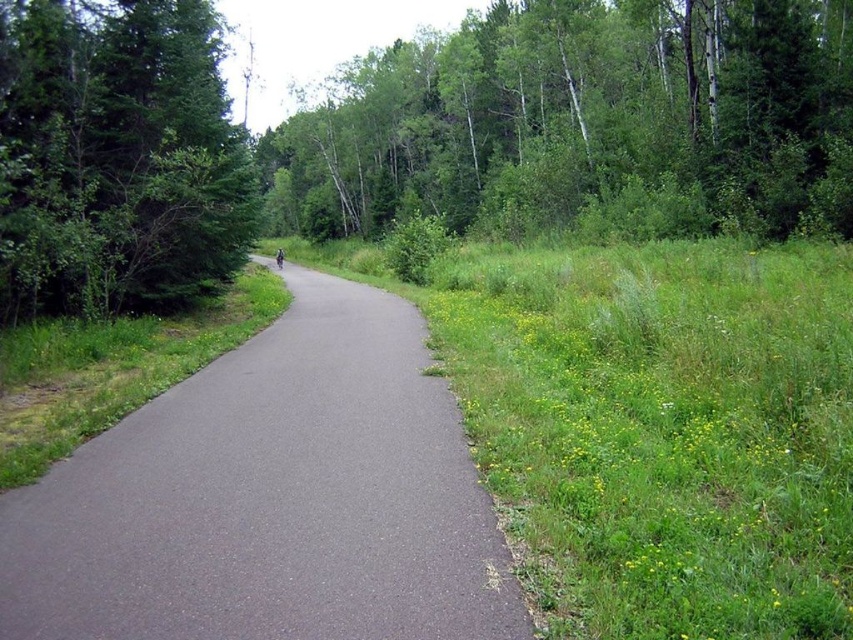
Question: Is gray asphalt trail at center positioned before green leafy tree at left?

Choices:
 (A) yes
 (B) no

Answer: (A)

Question: Which point is closer to the camera taking this photo?

Choices:
 (A) (166, 136)
 (B) (637, 195)
 (C) (378, 468)

Answer: (C)

Question: Considering the relative positions of green leafy trees at upper center and green leafy tree at left in the image provided, where is green leafy trees at upper center located with respect to green leafy tree at left?

Choices:
 (A) above
 (B) below

Answer: (A)

Question: Which of the following is the closest to the observer?

Choices:
 (A) (605, 44)
 (B) (402, 509)

Answer: (B)

Question: Does green leafy trees at upper center have a smaller size compared to green leafy tree at left?

Choices:
 (A) no
 (B) yes

Answer: (A)

Question: Based on their relative distances, which object is farther from the green leafy trees at upper center?

Choices:
 (A) gray asphalt trail at center
 (B) green leafy tree at left

Answer: (A)